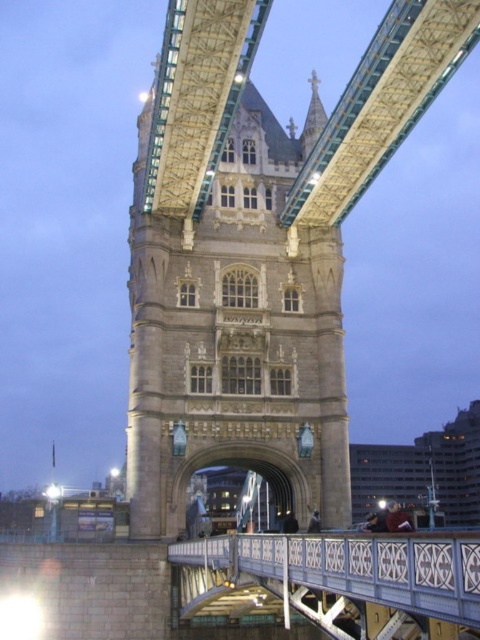
You are standing on the south bank of the Thames River, looking north towards Tower Bridge. You notice two points marked on the bridge structure. One is at coordinates point (331, 426) and the other is at point (288, 605). Which of these points is closer to you?

Point (288, 605) is closer to you because it is in front of point (331, 426).

You are standing on the south bank of the Thames River, looking north toward Tower Bridge. You want to take a photo of the stone tower at center from a position where it appears twice as large as it does now. How much closer must you move to achieve this?

To make the stone tower at center appear twice as large, you need to move closer so that the distance is halved. Since the current distance is 50.32 meters, moving to 25.16 meters away would double its apparent size.

You are an architect analyzing the structural design of Tower Bridge. Based on the image, which object is taller between the stone tower at center and the white painted metal bridge at center?

The stone tower at center is taller than the white painted metal bridge at center according to the description.